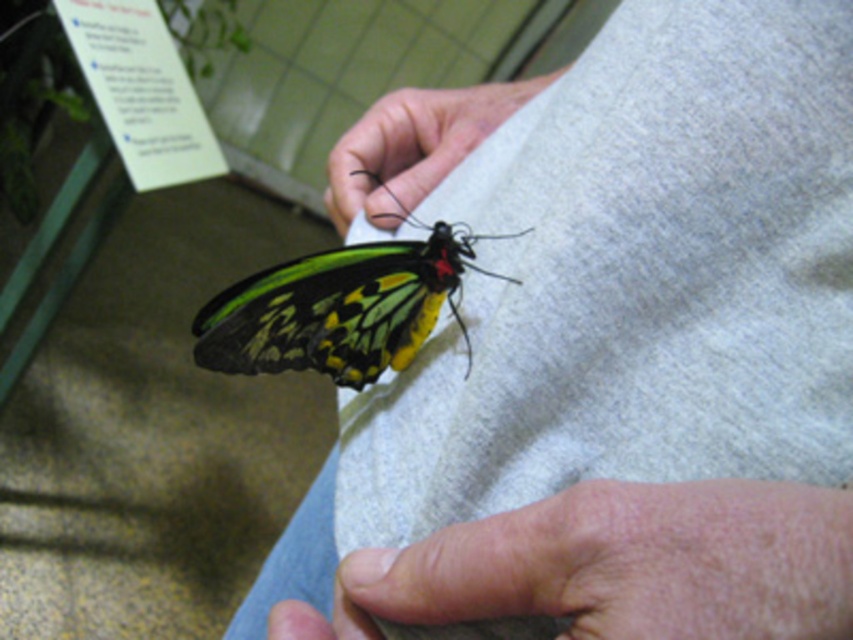
You are a visitor at a butterfly exhibit and notice the dry skin at lower center and the shiny metallic butterfly at center. Which object is closer to you based on their positions?

The dry skin at lower center is closer to you because it is positioned in front of the shiny metallic butterfly at center.